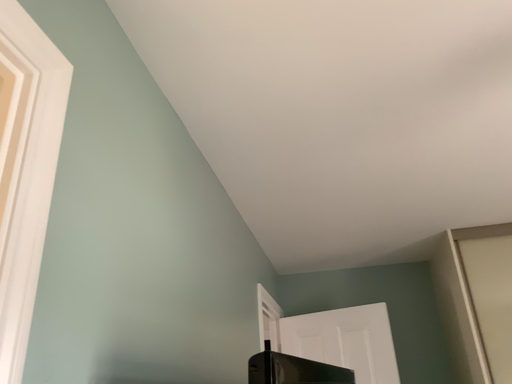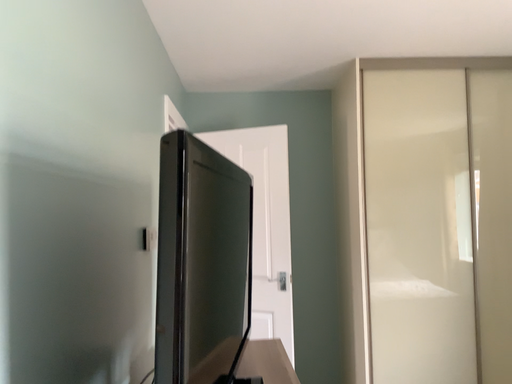
Question: Which way did the camera rotate in the video?

Choices:
 (A) rotated right
 (B) rotated left

Answer: (A)